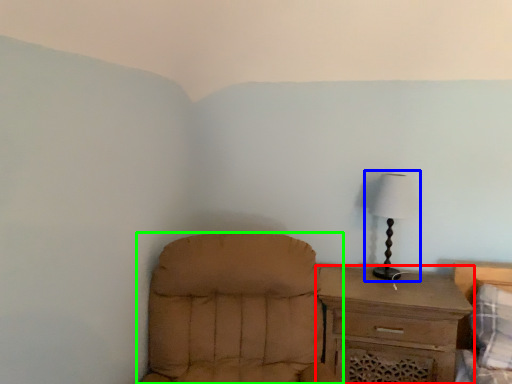
Question: Which object is the closest to the chest of drawers (highlighted by a red box)? Choose among these: lamp (highlighted by a blue box) or chair (highlighted by a green box).

Choices:
 (A) lamp
 (B) chair

Answer: (A)